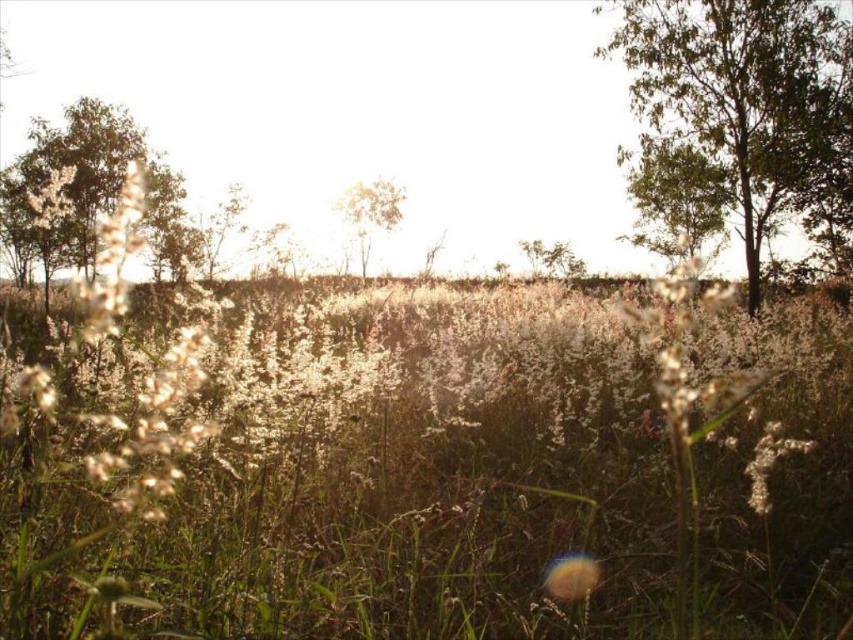
Question: From the image, what is the correct spatial relationship of green leafy tree at upper right in relation to brown wood tree at center?

Choices:
 (A) left
 (B) right

Answer: (B)

Question: Can you confirm if green leafy tree at upper right is positioned to the right of white fluffy flower at center?

Choices:
 (A) yes
 (B) no

Answer: (A)

Question: Which of the following is the farthest from the observer?

Choices:
 (A) white fluffy flower at center
 (B) green leafy tree at center
 (C) green matte tree at left

Answer: (B)

Question: Which object is the farthest from the green matte tree at left?

Choices:
 (A) white fluffy flower at center
 (B) green leafy tree at upper right
 (C) brown wood tree at center
 (D) green leafy tree at center

Answer: (A)

Question: Which of the following is the farthest from the observer?

Choices:
 (A) white fluffy flower at center
 (B) green matte tree at left

Answer: (B)

Question: From the image, what is the correct spatial relationship of white fluffy flower at center in relation to green leafy tree at center?

Choices:
 (A) right
 (B) left

Answer: (B)